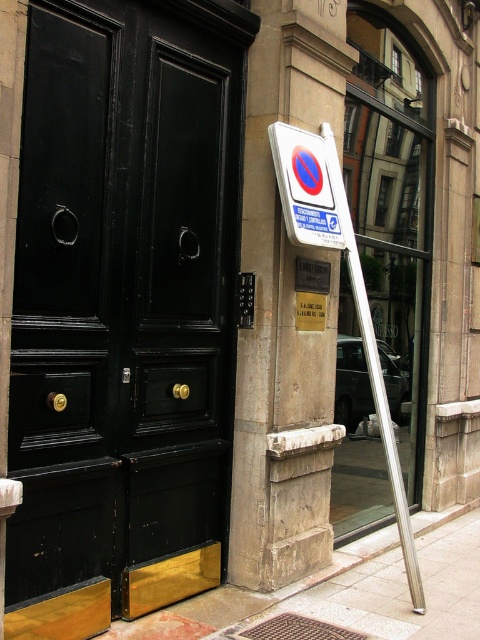
Consider the image. Can you confirm if black polished wood door at center is positioned above white plastic sign at center?

Indeed, black polished wood door at center is positioned over white plastic sign at center.

Locate an element on the screen. black polished wood door at center is located at coordinates (119, 301).

Does point (158, 483) come behind point (276, 170)?

No, it is not.

Locate an element on the screen. Image resolution: width=480 pixels, height=640 pixels. black polished wood door at center is located at coordinates (119, 301).

Can you confirm if black polished wood door at center is positioned to the left of stone pillar at center?

Yes, black polished wood door at center is to the left of stone pillar at center.

Is point (163, 577) behind point (254, 227)?

No, it is in front of (254, 227).

Describe the element at coordinates (119, 301) in the screenshot. Image resolution: width=480 pixels, height=640 pixels. I see `black polished wood door at center` at that location.

Locate an element on the screen. The image size is (480, 640). black polished wood door at center is located at coordinates (119, 301).

Between point (437, 612) and point (303, 218), which one is positioned behind?

The point (303, 218) is behind.

In the scene shown: Does smooth concrete sidewalk at lower center appear on the left side of white plastic sign at center?

In fact, smooth concrete sidewalk at lower center is to the right of white plastic sign at center.

You are a GUI agent. You are given a task and a screenshot of the screen. Output one action in this format:
    pyautogui.click(x=<x>, y=<y>)
    Task: Click on the smooth concrete sidewalk at lower center
    This screenshot has width=480, height=640.
    Given the screenshot: What is the action you would take?
    pyautogui.click(x=392, y=586)

At what (x,y) coordinates should I click in order to perform the action: click on smooth concrete sidewalk at lower center. Please return your answer as a coordinate pair (x, y). The height and width of the screenshot is (640, 480). Looking at the image, I should click on (392, 586).